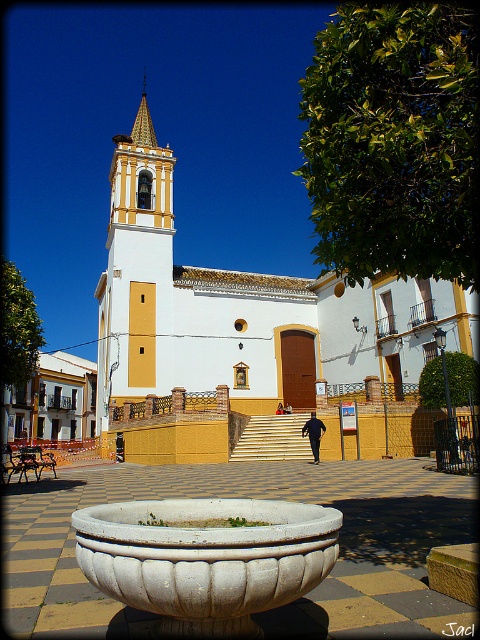
Question: Is white stucco church at center to the right of white stone bowl at center from the viewer's perspective?

Choices:
 (A) no
 (B) yes

Answer: (A)

Question: Which of these objects is positioned closest to the white stone planter at center?

Choices:
 (A) white stone bowl at center
 (B) white stucco church at center

Answer: (A)

Question: Is white stucco church at center above white stone planter at center?

Choices:
 (A) no
 (B) yes

Answer: (B)

Question: Considering the real-world distances, which object is closest to the white stone bowl at center?

Choices:
 (A) white stone planter at center
 (B) white stucco church at center

Answer: (A)

Question: Does white stone planter at center have a greater width compared to dark blue fabric man at center?

Choices:
 (A) no
 (B) yes

Answer: (B)

Question: Among these points, which one is nearest to the camera?

Choices:
 (A) (62, 492)
 (B) (152, 372)
 (C) (312, 438)
 (D) (207, 564)

Answer: (D)